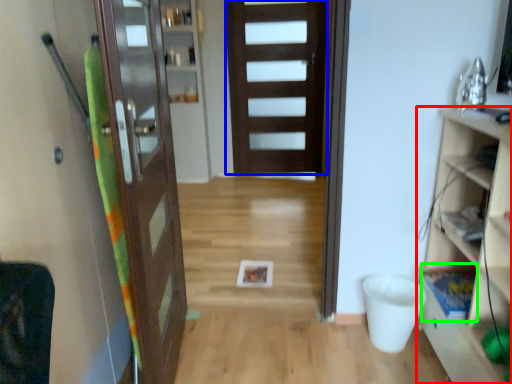
Question: Based on their relative distances, which object is farther from cabinetry (highlighted by a red box)? Choose from door (highlighted by a blue box) and shelf (highlighted by a green box).

Choices:
 (A) door
 (B) shelf

Answer: (A)